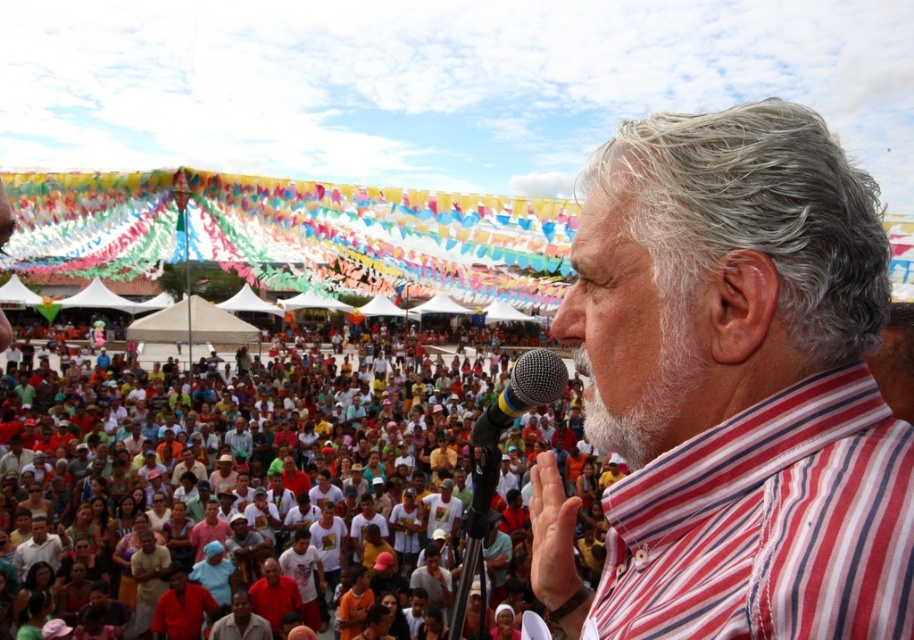
You are a photographer positioned at the back of the crowd, aiming to capture a clear shot of the speaker wearing the red striped shirt at center. However, you notice the multicolored plastic microphone at center is blocking your view. Can you adjust your angle to focus on the speaker without the microphone obstructing the shot?

The red striped shirt at center is closer to the viewer than the multicolored plastic microphone at center, so adjusting your angle might not help because the microphone is further away and the speaker is in front. The microphone is already behind the speaker, so it shouldn t block the view.

In the scene shown: You are organizing a small workshop and need to decide whether the multicolored plastic microphone at center can be placed on a shelf that is 1 meter wide. Given that the multicolored fabric crowd at center is wider than the microphone, and the crowd itself is 2 meters wide, will the microphone fit on the shelf?

The multicolored fabric crowd at center is 2 meters wide and wider than the multicolored plastic microphone at center. Since the microphone is narrower than 2 meters, it should fit on a 1 meter wide shelf, but wait, actually the crowd is 2 meters and wider than the microphone, so the microphone must be less than 2 meters. However, a 1 meter shelf may or may not be sufficient depending on the microphone exact width. But according to the description, since the crowd is wider than the microphone, and the crowd

You are at the event and want to move from the location of point (517,365) to the location of point (430,566). Given the crowd density described in the scene, will you need to walk through the dense crowd area?

Yes, you will need to walk through the dense crowd area because point (430,566) is behind point (517,365), implying that moving from the latter to the former requires passing through the densely packed crowd.